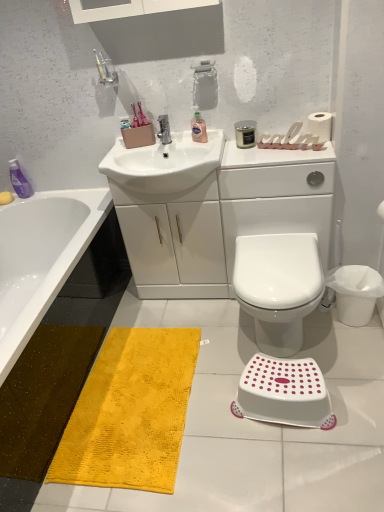
You are a GUI agent. You are given a task and a screenshot of the screen. Output one action in this format:
    pyautogui.click(x=<x>, y=<y>)
    Task: Click on the spots to the right of purple glossy bottle at upper left, which is the 2th toiletry in right-to-left order
    
    Given the screenshot: What is the action you would take?
    pyautogui.click(x=53, y=197)